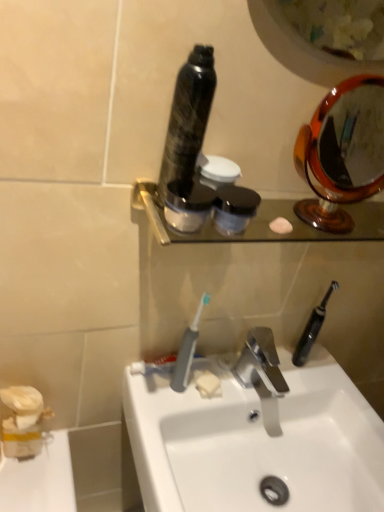
Identify the location of vacant area that is situated to the right of black plastic toothbrush at right, positioned as the second toothbrush in front-to-back order. The width and height of the screenshot is (384, 512). (340, 382).